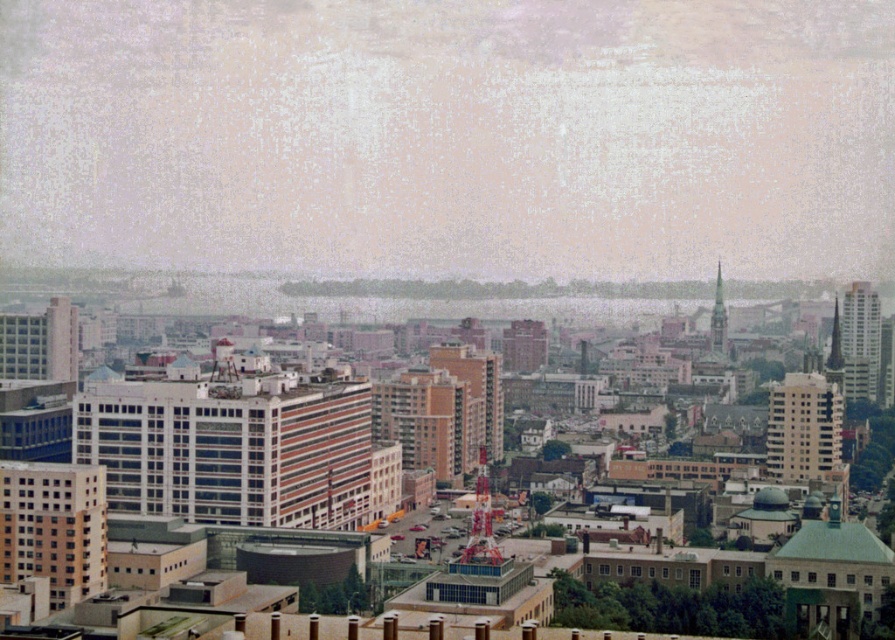
You are a drone operator trying to capture a photo of the orange brick building at lower left and the brown brick building at center. From your current position above the city, which building appears closer to the ground?

The orange brick building at lower left is positioned under the brown brick building at center, so it appears closer to the ground.

You are a drone operator trying to deliver a package from your current position to the brown brick building at center. The drone has a maximum range of 600 meters. Can you safely complete the delivery without needing to recharge?

The distance between your current position and the brown brick building at center is 646.41 meters, which exceeds the drone delivery range of 600 meters. Therefore, the drone cannot safely complete the delivery without needing to recharge.

You are a city planner assessing the distance between two key buildings in the city layout. The orange brick building at lower left and the brown brick building at center are part of a proposed pedestrian walkway. Can a 100 meter long walkway connect them without needing to extend its length?

The orange brick building at lower left and brown brick building at center are 106.56 meters apart. Since the proposed 100 meter walkway is shorter than the required distance, it cannot connect them without extension.